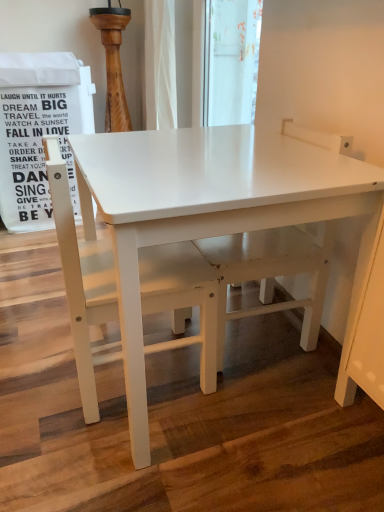
Image resolution: width=384 pixels, height=512 pixels. What do you see at coordinates (82, 281) in the screenshot?
I see `white matte chair at center` at bounding box center [82, 281].

Where is `white matte chair at center`? The image size is (384, 512). white matte chair at center is located at coordinates (82, 281).

In order to face white matte chair at center, should I rotate leftwards or rightwards?

It's best to rotate left around 9.547 degrees.

What is the approximate width of white matte table at center?

22.60 inches.

Find the location of a particular element. This screenshot has height=512, width=384. white matte table at center is located at coordinates (192, 239).

Describe the element at coordinates (192, 239) in the screenshot. Image resolution: width=384 pixels, height=512 pixels. I see `white matte table at center` at that location.

Locate an element on the screen. white matte chair at center is located at coordinates (82, 281).

Which is more to the right, white matte chair at center or white matte table at center?

white matte table at center.

Does white matte chair at center come behind white matte table at center?

Yes, it is.

Which is less distant, [212,286] or [281,309]?

Point [212,286] is positioned closer to the camera compared to point [281,309].

From the picture: From the image's perspective, is white matte chair at center positioned above or below white matte table at center?

white matte chair at center is below white matte table at center.

From a real-world perspective, is white matte chair at center physically above white matte table at center?

Yes, from a real-world perspective, white matte chair at center is over white matte table at center

Between white matte chair at center and white matte table at center, which one has larger width?

Wider between the two is white matte table at center.

Is white matte chair at center taller or shorter than white matte table at center?

In the image, white matte chair at center appears to be shorter than white matte table at center.

Considering the relative sizes of white matte chair at center and white matte table at center in the image provided, is white matte chair at center smaller than white matte table at center?

Correct, white matte chair at center occupies less space than white matte table at center.

Is white matte table at center surrounded by white matte chair at center?

No.

Is white matte chair at center not near white matte table at center?

No, there isn't a large distance between white matte chair at center and white matte table at center.

Based on the photo, is white matte chair at center aimed at white matte table at center?

Yes, white matte chair at center is turned towards white matte table at center.

Locate an element on the screen. This screenshot has height=512, width=384. chair positioned vertically above the white matte table at center (from a real-world perspective) is located at coordinates (82, 281).

Is white matte table at center at the right side of white matte chair at center?

Indeed, white matte table at center is positioned on the right side of white matte chair at center.

Considering the relative positions of white matte table at center and white matte chair at center in the image provided, is white matte table at center behind white matte chair at center?

No, it is in front of white matte chair at center.

Is point (342, 214) closer to camera compared to point (93, 274)?

Yes, point (342, 214) is in front of point (93, 274).

From the image's perspective, is white matte table at center above or below white matte chair at center?

From the image's perspective, white matte table at center appears above white matte chair at center.

From the picture: From a real-world perspective, is white matte table at center located higher than white matte chair at center?

No, from a real-world perspective, white matte table at center is not over white matte chair at center

Considering the relative sizes of white matte table at center and white matte chair at center in the image provided, is white matte table at center thinner than white matte chair at center?

No, white matte table at center is not thinner than white matte chair at center.

Considering the sizes of objects white matte table at center and white matte chair at center in the image provided, who is shorter, white matte table at center or white matte chair at center?

Standing shorter between the two is white matte chair at center.

Is white matte table at center bigger than white matte chair at center?

Yes, white matte table at center is bigger than white matte chair at center.

Choose the correct answer: Is white matte table at center inside white matte chair at center or outside it?

white matte table at center is outside white matte chair at center.

Would you consider white matte table at center to be distant from white matte chair at center?

Actually, white matte table at center and white matte chair at center are a little close together.

Does white matte table at center turn towards white matte chair at center?

Yes, white matte table at center is oriented towards white matte chair at center.

What's the angular difference between white matte table at center and white matte chair at center's facing directions?

The angle between the facing direction of white matte table at center and the facing direction of white matte chair at center is 180 degrees.

Identify the location of chair above the white matte table at center (from a real-world perspective). The width and height of the screenshot is (384, 512). (82, 281).

I want to click on chair behind the white matte table at center, so click(x=82, y=281).

Identify the location of table in front of the white matte chair at center. Image resolution: width=384 pixels, height=512 pixels. (192, 239).